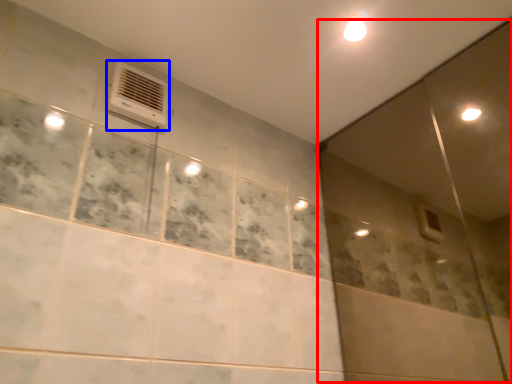
Question: Which object appears closest to the camera in this image, screen door (highlighted by a red box) or air conditioning (highlighted by a blue box)?

Choices:
 (A) screen door
 (B) air conditioning

Answer: (A)